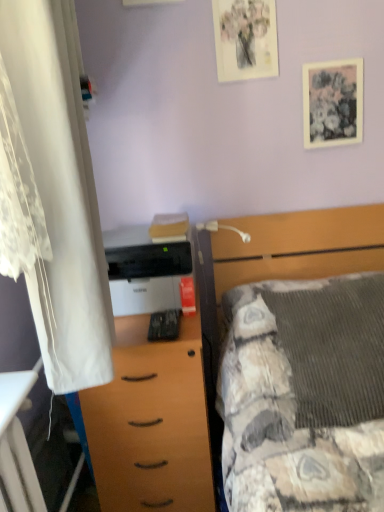
Locate an element on the screen. empty space that is ontop of white matte printer at center is located at coordinates (139, 234).